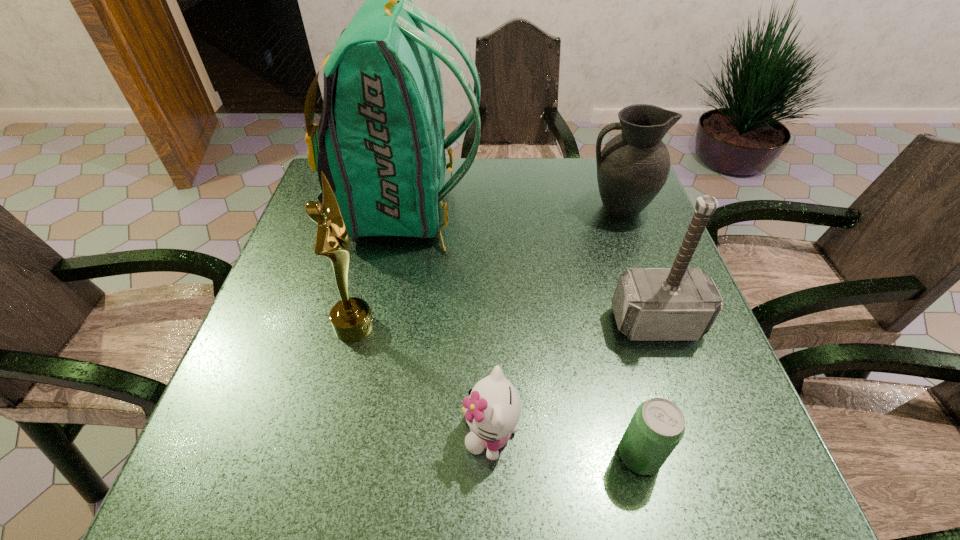
Locate an element on the screen. This screenshot has height=540, width=960. backpack at the left edge is located at coordinates (380, 142).

At what (x,y) coordinates should I click in order to perform the action: click on award at the left edge. Please return your answer as a coordinate pair (x, y). The width and height of the screenshot is (960, 540). Looking at the image, I should click on (x=351, y=318).

This screenshot has width=960, height=540. In order to click on hammer located at the right edge in this screenshot , I will do `click(650, 304)`.

Locate an element on the screen. The height and width of the screenshot is (540, 960). pitcher present at the right edge is located at coordinates (632, 168).

Locate an element on the screen. The height and width of the screenshot is (540, 960). soda at the right edge is located at coordinates (658, 425).

Find the location of `object present at the far left corner`. object present at the far left corner is located at coordinates (380, 142).

Where is `object at the far right corner`? This screenshot has height=540, width=960. object at the far right corner is located at coordinates (632, 168).

The image size is (960, 540). What are the coordinates of `object that is at the near right corner` in the screenshot? It's located at (658, 425).

Find the location of a particular element. The width and height of the screenshot is (960, 540). free space at the far edge of the desktop is located at coordinates (452, 205).

In the image, there is a desktop. Where is `blank space at the near edge`? blank space at the near edge is located at coordinates (606, 470).